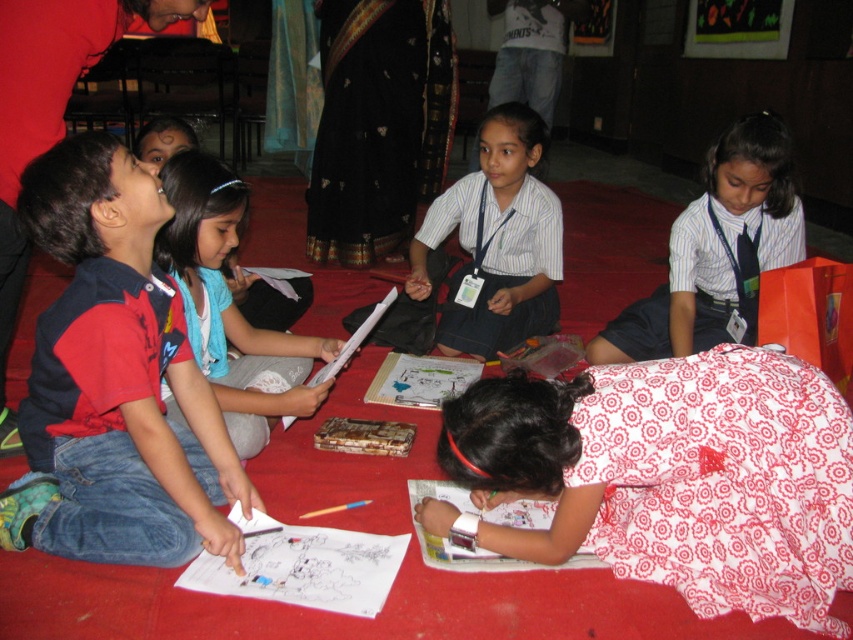
Can you confirm if red shirt at left is thinner than white striped shirt at center?

Correct, red shirt at left's width is less than white striped shirt at center's.

Which is more to the left, red shirt at left or white striped shirt at center?

red shirt at left is more to the left.

Measure the distance between point (213,513) and camera.

A distance of 1.72 meters exists between point (213,513) and camera.

Identify the location of red shirt at left. The image size is (853, 640). (117, 376).

From the picture: Is white striped shirt at upper center taller than white striped shirt at center?

No, white striped shirt at upper center is not taller than white striped shirt at center.

Who is positioned more to the right, white striped shirt at upper center or white striped shirt at center?

From the viewer's perspective, white striped shirt at upper center appears more on the right side.

Is point (693, 289) less distant than point (540, 278)?

Yes, it is in front of point (540, 278).

At what (x,y) coordinates should I click in order to perform the action: click on white striped shirt at upper center. Please return your answer as a coordinate pair (x, y). Image resolution: width=853 pixels, height=640 pixels. Looking at the image, I should click on (717, 250).

Does white dotted dress at lower right have a greater width compared to red shirt at left?

Yes, white dotted dress at lower right is wider than red shirt at left.

Between point (746, 387) and point (131, 269), which one is positioned in front?

Point (746, 387)

Where is `white dotted dress at lower right`? white dotted dress at lower right is located at coordinates (674, 476).

You are a GUI agent. You are given a task and a screenshot of the screen. Output one action in this format:
    pyautogui.click(x=<x>, y=<y>)
    Task: Click on the white dotted dress at lower right
    The height and width of the screenshot is (640, 853).
    Given the screenshot: What is the action you would take?
    pyautogui.click(x=674, y=476)